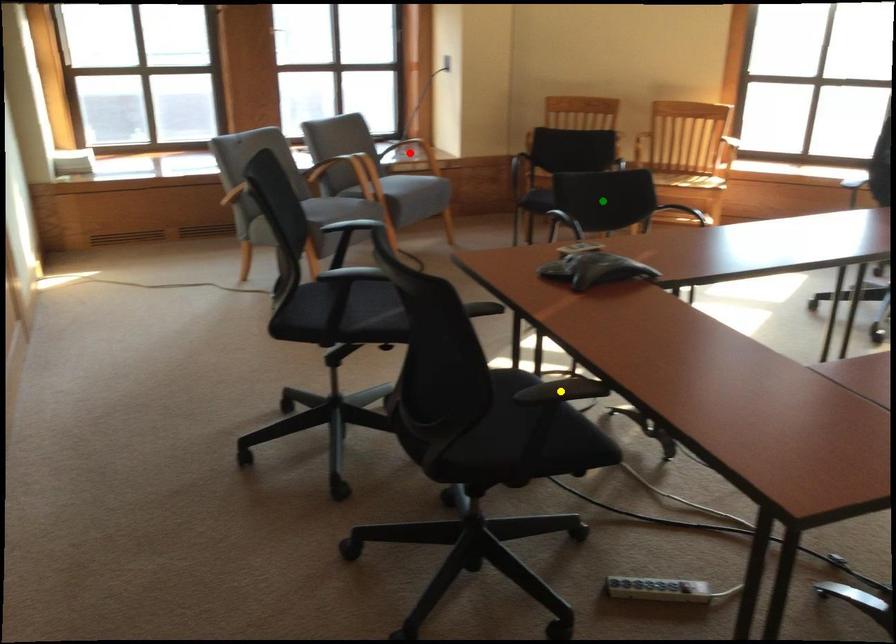
Order these from nearest to farthest:
green point, red point, yellow point

yellow point, green point, red point